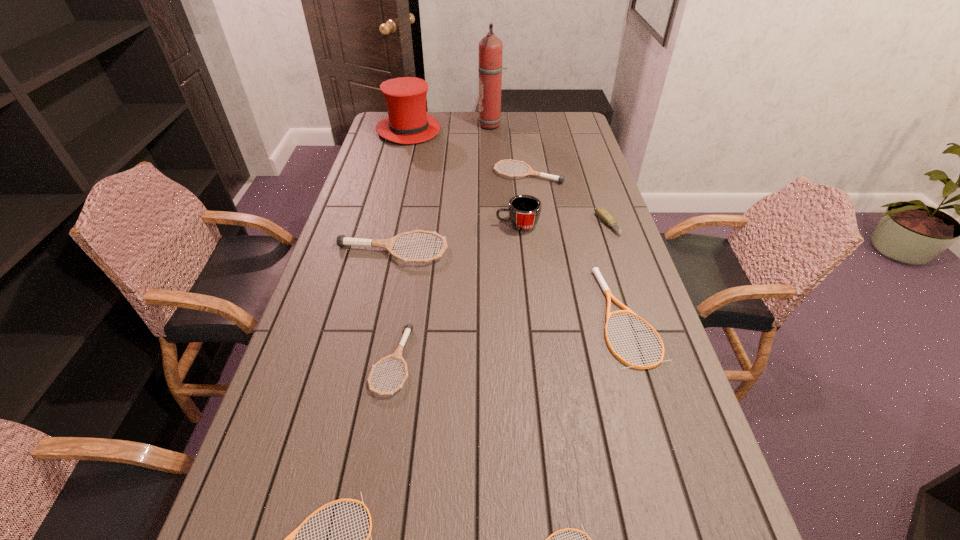
Locate an element on the screen. The width and height of the screenshot is (960, 540). gray pocketknife is located at coordinates (604, 215).

This screenshot has width=960, height=540. What are the coordinates of `the third tallest tennis racket` in the screenshot? It's located at (397, 354).

At what (x,y) coordinates should I click in order to perform the action: click on the nearest gray tennis racket. Please return your answer as a coordinate pair (x, y). Looking at the image, I should click on (397, 354).

Find the location of `the third shortest tennis racket`. the third shortest tennis racket is located at coordinates (595, 270).

You are a GUI agent. You are given a task and a screenshot of the screen. Output one action in this format:
    pyautogui.click(x=<x>, y=<y>)
    Task: Click on the farthest beige tennis racket
    The width and height of the screenshot is (960, 540).
    Given the screenshot: What is the action you would take?
    pyautogui.click(x=595, y=270)

Locate an element on the screen. The image size is (960, 540). vacant space located 0.290m on the side of the red fire extinguisher with the label and nozzle is located at coordinates (414, 126).

Where is `vacant region located 0.230m on the side of the red fire extinguisher with the label and nozzle`? Image resolution: width=960 pixels, height=540 pixels. vacant region located 0.230m on the side of the red fire extinguisher with the label and nozzle is located at coordinates click(427, 126).

The image size is (960, 540). I want to click on free space located 0.160m on the side of the red fire extinguisher with the label and nozzle, so click(443, 126).

Find the location of a particular element. free location located 0.220m on the front of the hat is located at coordinates (x=397, y=174).

Locate an element on the screen. Image resolution: width=960 pixels, height=540 pixels. vacant space located 0.260m on the side of the mug with the handle is located at coordinates (417, 225).